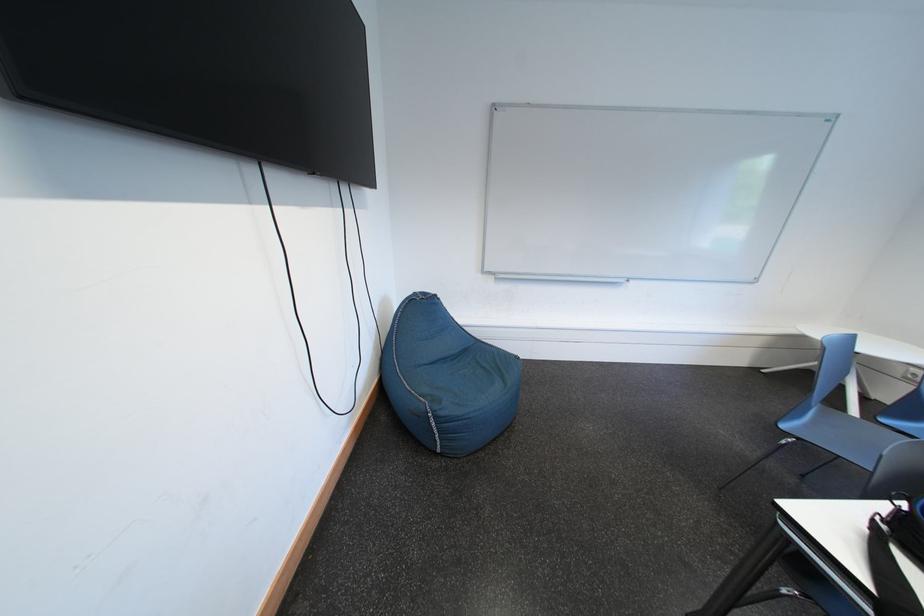
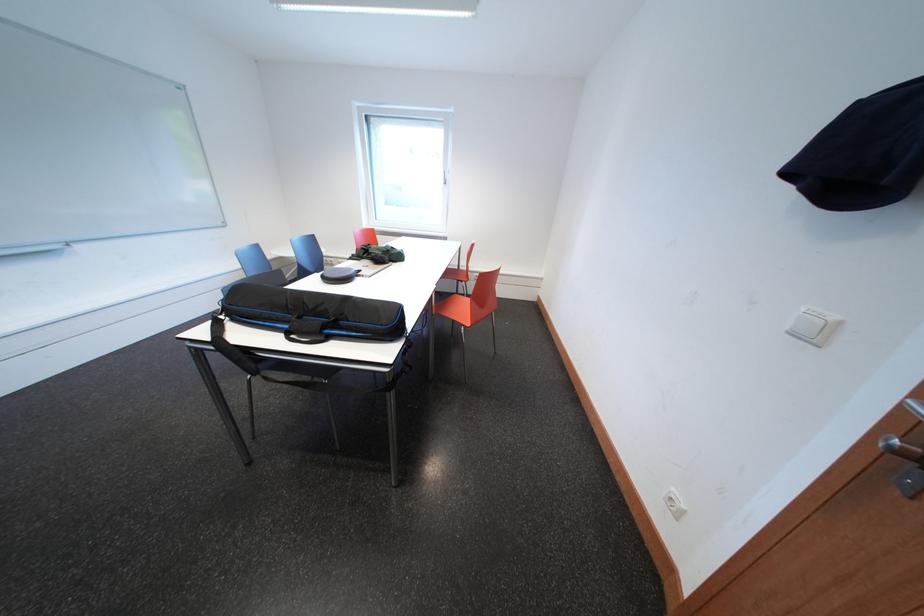
First-person continuous shooting, in which direction is the camera rotating?

The camera rotated toward right-down.